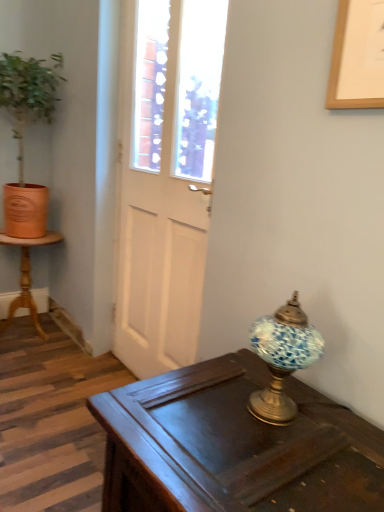
Locate an element on the screen. The image size is (384, 512). free space behind blue mosaic glass lamp at right is located at coordinates (258, 374).